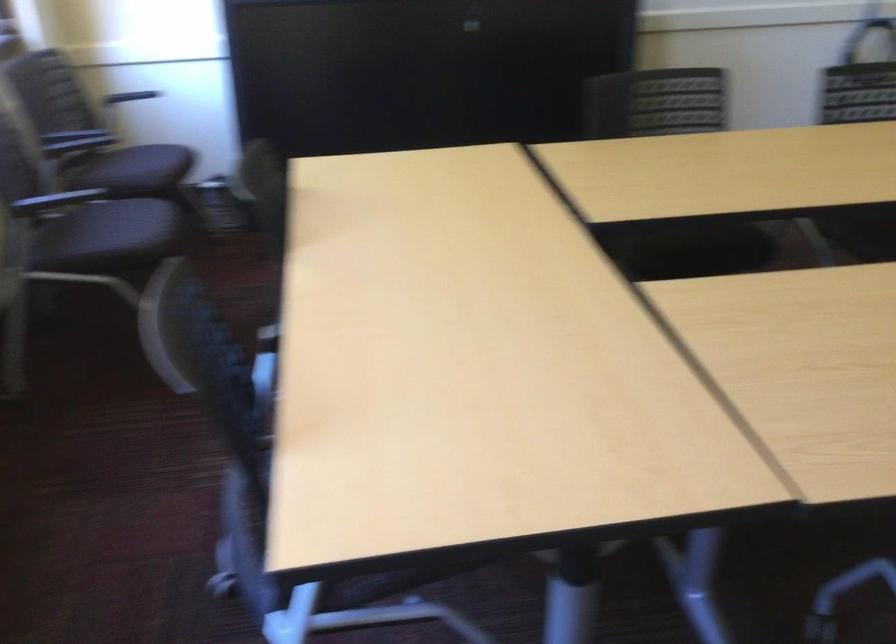
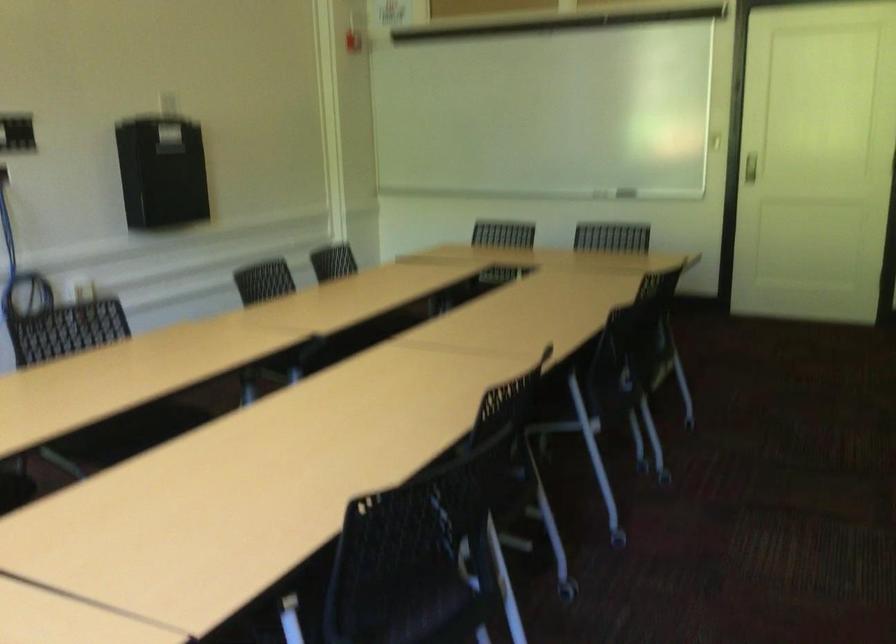
Question: Based on the continuous images, in which direction is the camera rotating? Reply with the corresponding letter.

Choices:
 (A) Left
 (B) Right
 (C) Up
 (D) Down

Answer: (B)